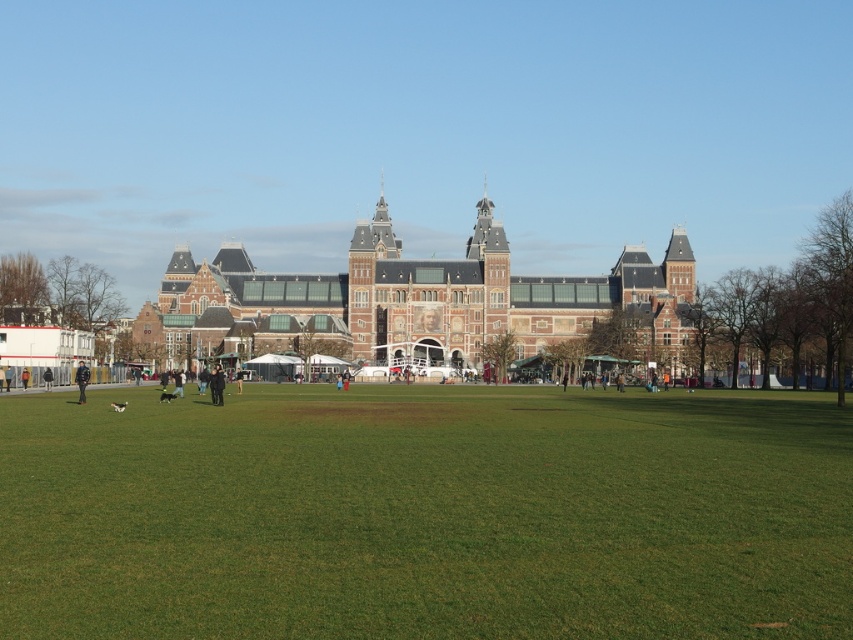
Measure the distance between point (154,528) and camera.

Point (154,528) is 206.01 feet from camera.

Can you confirm if green grass at center is thinner than dark brown leather jacket at center?

No.

Is point (373, 461) behind point (212, 381)?

That is False.

Find the location of a particular element. green grass at center is located at coordinates (426, 515).

Is dark brown leather jacket at center bigger than black leather jacket at lower left?

Incorrect, dark brown leather jacket at center is not larger than black leather jacket at lower left.

Who is more forward, (215, 401) or (86, 376)?

Positioned in front is point (215, 401).

Identify the location of dark brown leather jacket at center. This screenshot has height=640, width=853. (216, 385).

Is point (637, 397) farther from viewer compared to point (80, 390)?

That is True.

Is point (373, 541) closer to viewer compared to point (78, 396)?

Yes.

Is point (131, 474) less distant than point (78, 400)?

Yes, point (131, 474) is closer to viewer.

Locate an element on the screen. This screenshot has height=640, width=853. green grass at center is located at coordinates (426, 515).